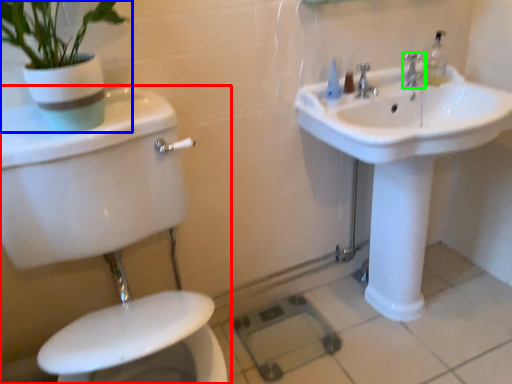
Question: Which is farther away from toilet (highlighted by a red box)? houseplant (highlighted by a blue box) or tap (highlighted by a green box)?

Choices:
 (A) houseplant
 (B) tap

Answer: (B)